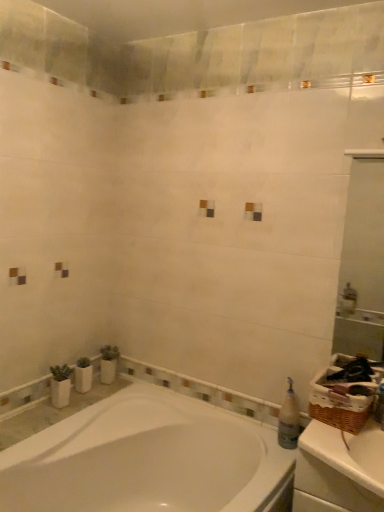
Question: From a real-world perspective, is white glossy mirror at upper right below white glossy bathtub at lower left?

Choices:
 (A) no
 (B) yes

Answer: (A)

Question: Is white glossy mirror at upper right at the left side of white glossy bathtub at lower left?

Choices:
 (A) no
 (B) yes

Answer: (A)

Question: Does white glossy mirror at upper right turn towards white glossy bathtub at lower left?

Choices:
 (A) yes
 (B) no

Answer: (B)

Question: From the image's perspective, would you say white glossy mirror at upper right is positioned over white glossy bathtub at lower left?

Choices:
 (A) yes
 (B) no

Answer: (A)

Question: Can you confirm if white glossy mirror at upper right is wider than white glossy bathtub at lower left?

Choices:
 (A) no
 (B) yes

Answer: (A)

Question: From a real-world perspective, is white glossy mirror at upper right located higher than white glossy bathtub at lower left?

Choices:
 (A) no
 (B) yes

Answer: (B)

Question: Would you say translucent plastic bottle at right is outside white glossy bathtub at lower left?

Choices:
 (A) no
 (B) yes

Answer: (B)

Question: Is translucent plastic bottle at right further to camera compared to white glossy bathtub at lower left?

Choices:
 (A) no
 (B) yes

Answer: (B)

Question: From the image's perspective, would you say translucent plastic bottle at right is positioned over white glossy bathtub at lower left?

Choices:
 (A) no
 (B) yes

Answer: (B)

Question: Is translucent plastic bottle at right bigger than white glossy bathtub at lower left?

Choices:
 (A) yes
 (B) no

Answer: (B)

Question: Is white glossy bathtub at lower left a part of translucent plastic bottle at right?

Choices:
 (A) no
 (B) yes

Answer: (A)

Question: Can you confirm if translucent plastic bottle at right is taller than white glossy bathtub at lower left?

Choices:
 (A) no
 (B) yes

Answer: (A)

Question: Considering the relative sizes of white glossy bathtub at lower left and white matte counter top at right in the image provided, is white glossy bathtub at lower left wider than white matte counter top at right?

Choices:
 (A) yes
 (B) no

Answer: (A)